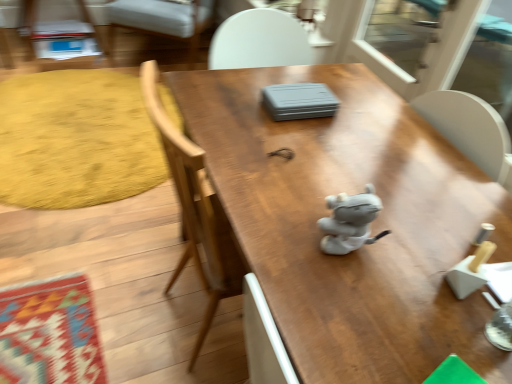
At what (x,y) coordinates should I click in order to perform the action: click on empty space that is to the right of gray fabric toy at center. Please return your answer as a coordinate pair (x, y). The image size is (512, 384). Looking at the image, I should click on (414, 237).